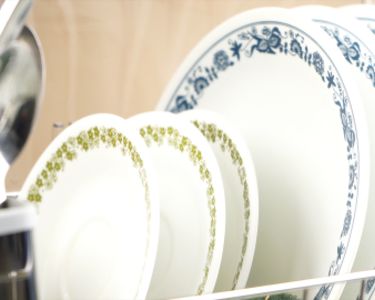
The width and height of the screenshot is (375, 300). I want to click on plates, so click(x=371, y=18), click(x=348, y=30), click(x=319, y=49), click(x=218, y=135), click(x=190, y=161), click(x=132, y=180).